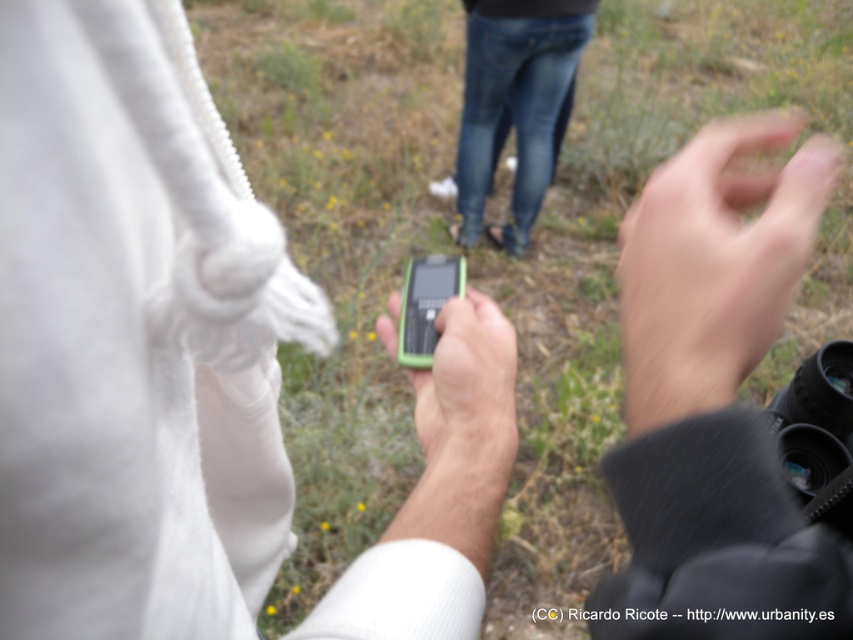
Question: Among these objects, which one is nearest to the camera?

Choices:
 (A) green matte phone at center
 (B) skinny flesh-toned hand at center

Answer: (A)

Question: Which point appears closest to the camera in this image?

Choices:
 (A) (790, 276)
 (B) (163, 189)
 (C) (401, 307)

Answer: (B)

Question: Does green plastic phone at center have a lesser width compared to green matte smartphone at center?

Choices:
 (A) yes
 (B) no

Answer: (B)

Question: Which of these objects is positioned farthest from the green plastic phone at center?

Choices:
 (A) skinny flesh-toned hand at center
 (B) green matte smartphone at center

Answer: (A)

Question: Can you confirm if green matte phone at center is smaller than green matte smartphone at center?

Choices:
 (A) yes
 (B) no

Answer: (B)

Question: Can you confirm if skinny flesh-toned hand at center is positioned to the left of green matte smartphone at center?

Choices:
 (A) no
 (B) yes

Answer: (A)